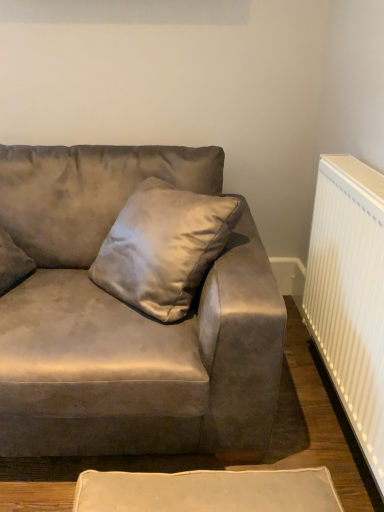
Question: Is satin gray pillow at center shorter than white ribbed radiator at right?

Choices:
 (A) yes
 (B) no

Answer: (B)

Question: From a real-world perspective, is satin gray pillow at center physically below white ribbed radiator at right?

Choices:
 (A) yes
 (B) no

Answer: (B)

Question: Is satin gray pillow at center next to white ribbed radiator at right?

Choices:
 (A) no
 (B) yes

Answer: (A)

Question: Is satin gray pillow at center far away from white ribbed radiator at right?

Choices:
 (A) yes
 (B) no

Answer: (B)

Question: Considering the relative sizes of satin gray pillow at center and white ribbed radiator at right in the image provided, is satin gray pillow at center taller than white ribbed radiator at right?

Choices:
 (A) no
 (B) yes

Answer: (B)

Question: From a real-world perspective, is satin gray pillow at center above or below suede gray couch at center?

Choices:
 (A) below
 (B) above

Answer: (B)

Question: Is satin gray pillow at center situated inside suede gray couch at center or outside?

Choices:
 (A) outside
 (B) inside

Answer: (B)

Question: From the image's perspective, relative to suede gray couch at center, is satin gray pillow at center above or below?

Choices:
 (A) above
 (B) below

Answer: (A)

Question: Considering the positions of satin gray pillow at center and suede gray couch at center in the image, is satin gray pillow at center taller or shorter than suede gray couch at center?

Choices:
 (A) short
 (B) tall

Answer: (A)

Question: Visually, is white ribbed radiator at right positioned to the left or to the right of satin gray pillow at center?

Choices:
 (A) left
 (B) right

Answer: (B)

Question: Is white ribbed radiator at right bigger or smaller than satin gray pillow at center?

Choices:
 (A) small
 (B) big

Answer: (A)

Question: In terms of height, does white ribbed radiator at right look taller or shorter compared to satin gray pillow at center?

Choices:
 (A) short
 (B) tall

Answer: (A)

Question: Is white ribbed radiator at right wider or thinner than satin gray pillow at center?

Choices:
 (A) wide
 (B) thin

Answer: (B)

Question: Visually, is suede gray couch at center positioned to the left or to the right of satin gray pillow at center?

Choices:
 (A) left
 (B) right

Answer: (A)

Question: Based on their sizes in the image, would you say suede gray couch at center is bigger or smaller than satin gray pillow at center?

Choices:
 (A) big
 (B) small

Answer: (A)